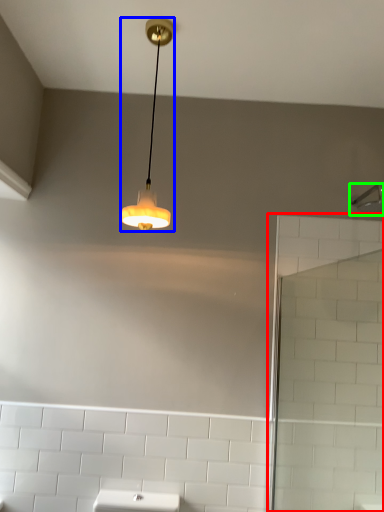
Question: Based on their relative distances, which object is farther from screen door (highlighted by a red box)? Choose from lamp (highlighted by a blue box) and shower (highlighted by a green box).

Choices:
 (A) lamp
 (B) shower

Answer: (A)